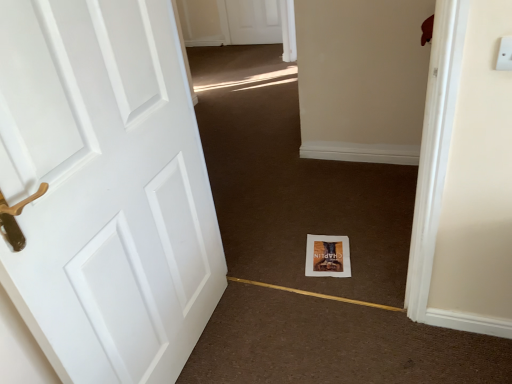
This screenshot has width=512, height=384. I want to click on matte paper book at center, so click(327, 256).

What do you see at coordinates (327, 256) in the screenshot? The height and width of the screenshot is (384, 512). I see `matte paper book at center` at bounding box center [327, 256].

What do you see at coordinates (505, 54) in the screenshot? I see `white plastic electric outlet at upper right` at bounding box center [505, 54].

Image resolution: width=512 pixels, height=384 pixels. I want to click on white paper at center, so click(293, 182).

Looking at this image, from the image's perspective, which object appears higher, white matte door at left or white paper at center?

Result: white paper at center, from the image's perspective.

Does white matte door at left have a greater height compared to white paper at center?

Yes.

Is white matte door at left directly adjacent to white paper at center?

No, white matte door at left is not making contact with white paper at center.

Based on the photo, how much distance is there between white matte door at left and white paper at center?

1.01 meters.

Is white plastic electric outlet at upper right located within matte paper book at center?

No.

Measure the distance between matte paper book at center and white plastic electric outlet at upper right.

matte paper book at center is 1.18 meters from white plastic electric outlet at upper right.

Does matte paper book at center appear on the left side of white plastic electric outlet at upper right?

Yes, matte paper book at center is to the left of white plastic electric outlet at upper right.

From a real-world perspective, which is physically below, matte paper book at center or white plastic electric outlet at upper right?

matte paper book at center, from a real-world perspective.

Considering the sizes of objects white paper at center and matte paper book at center in the image provided, who is wider, white paper at center or matte paper book at center?

matte paper book at center is wider.

From the image's perspective, which one is positioned lower, white paper at center or matte paper book at center?

matte paper book at center is shown below in the image.

Is white paper at center at the left side of matte paper book at center?

Indeed, white paper at center is positioned on the left side of matte paper book at center.

What's the angular difference between white paper at center and matte paper book at center's facing directions?

white paper at center and matte paper book at center are facing 10.3 degrees away from each other.

Between white matte door at left and matte paper book at center, which one appears on the left side from the viewer's perspective?

Positioned to the left is white matte door at left.

From the image's perspective, is white matte door at left on matte paper book at center?

Yes.

Identify the location of print on the right of white matte door at left. The height and width of the screenshot is (384, 512). (327, 256).

Can you tell me how much white plastic electric outlet at upper right and matte paper book at center differ in facing direction?

There is a 10.7-degree angle between the facing directions of white plastic electric outlet at upper right and matte paper book at center.

At what (x,y) coordinates should I click in order to perform the action: click on print that is below the white plastic electric outlet at upper right (from the image's perspective). Please return your answer as a coordinate pair (x, y). The image size is (512, 384). Looking at the image, I should click on (327, 256).

Is white plastic electric outlet at upper right positioned beyond the bounds of matte paper book at center?

Yes, white plastic electric outlet at upper right is outside of matte paper book at center.

Is white plastic electric outlet at upper right directly adjacent to matte paper book at center?

No, white plastic electric outlet at upper right is not with matte paper book at center.

How many degrees apart are the facing directions of white paper at center and white plastic electric outlet at upper right?

The angular difference between white paper at center and white plastic electric outlet at upper right is 0.484 degrees.

Would you say white paper at center is inside or outside white plastic electric outlet at upper right?

white paper at center is located beyond the bounds of white plastic electric outlet at upper right.

Is white paper at center far from white plastic electric outlet at upper right?

Yes, white paper at center is far from white plastic electric outlet at upper right.

You are a GUI agent. You are given a task and a screenshot of the screen. Output one action in this format:
    pyautogui.click(x=<x>, y=<y>)
    Task: Click on the electric outlet to the right of white matte door at left
    This screenshot has width=512, height=384.
    Given the screenshot: What is the action you would take?
    pyautogui.click(x=505, y=54)

Is white matte door at left far from white plastic electric outlet at upper right?

That's right, there is a large distance between white matte door at left and white plastic electric outlet at upper right.

Considering their positions, is white matte door at left located in front of or behind white plastic electric outlet at upper right?

Clearly, white matte door at left is in front of white plastic electric outlet at upper right.

Based on the photo, can you tell me how much white matte door at left and white plastic electric outlet at upper right differ in facing direction?

The angular difference between white matte door at left and white plastic electric outlet at upper right is 91.3 degrees.

What are the coordinates of `plain to the right of white matte door at left` in the screenshot? It's located at (293, 182).

Image resolution: width=512 pixels, height=384 pixels. Find the location of `print located underneath the white plastic electric outlet at upper right (from a real-world perspective)`. print located underneath the white plastic electric outlet at upper right (from a real-world perspective) is located at coordinates (327, 256).

Based on their spatial positions, is white paper at center or matte paper book at center further from white plastic electric outlet at upper right?

white paper at center is positioned further to the anchor white plastic electric outlet at upper right.

Considering their positions, is matte paper book at center positioned further to white paper at center than white plastic electric outlet at upper right?

white plastic electric outlet at upper right is further to white paper at center.

Which object lies nearer to the anchor point white plastic electric outlet at upper right, matte paper book at center or white paper at center?

Among the two, matte paper book at center is located nearer to white plastic electric outlet at upper right.

From the image, which object appears to be nearer to white paper at center, white plastic electric outlet at upper right or white matte door at left?

The object closer to white paper at center is white matte door at left.

When comparing their distances from matte paper book at center, does white matte door at left or white plastic electric outlet at upper right seem further?

white plastic electric outlet at upper right is positioned further to the anchor matte paper book at center.

Which object lies further to the anchor point matte paper book at center, white paper at center or white plastic electric outlet at upper right?

white plastic electric outlet at upper right is further to matte paper book at center.

In the scene shown: Which object lies nearer to the anchor point white plastic electric outlet at upper right, white matte door at left or matte paper book at center?

white matte door at left.

Looking at the image, which one is located closer to white paper at center, matte paper book at center or white matte door at left?

matte paper book at center lies closer to white paper at center than the other object.

Identify the location of electric outlet between white matte door at left and matte paper book at center along the z-axis. This screenshot has width=512, height=384. (505, 54).

At what (x,y) coordinates should I click in order to perform the action: click on plain positioned between white plastic electric outlet at upper right and matte paper book at center from near to far. Please return your answer as a coordinate pair (x, y). Image resolution: width=512 pixels, height=384 pixels. Looking at the image, I should click on (293, 182).

This screenshot has height=384, width=512. I want to click on plain positioned between white matte door at left and matte paper book at center from near to far, so point(293,182).

Locate an element on the screen. The height and width of the screenshot is (384, 512). plain between white matte door at left and white plastic electric outlet at upper right in the horizontal direction is located at coordinates (293, 182).